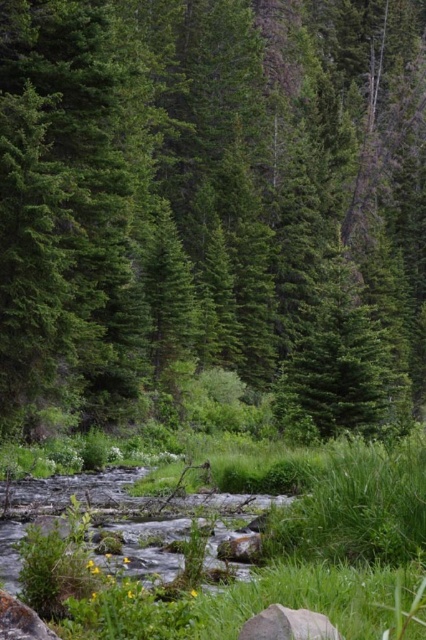
Based on the photo, can you confirm if green matte tree at center is positioned to the left of green grass at center?

Incorrect, green matte tree at center is not on the left side of green grass at center.

Which is behind, point (95, 97) or point (51, 550)?

Point (95, 97)

You are a GUI agent. You are given a task and a screenshot of the screen. Output one action in this format:
    pyautogui.click(x=<x>, y=<y>)
    Task: Click on the green matte tree at center
    The image size is (426, 640).
    Given the screenshot: What is the action you would take?
    click(196, 180)

The height and width of the screenshot is (640, 426). In order to click on green matte tree at center in this screenshot , I will do `click(196, 180)`.

What do you see at coordinates (196, 180) in the screenshot?
I see `green matte tree at center` at bounding box center [196, 180].

Identify the location of green matte tree at center. The height and width of the screenshot is (640, 426). (196, 180).

Does green grass at center lie in front of gray matte rock at lower center?

No.

Does green grass at center have a larger size compared to gray matte rock at lower center?

Correct, green grass at center is larger in size than gray matte rock at lower center.

Does point (273, 515) lie behind point (305, 612)?

Yes.

Where is `green grass at center`? The height and width of the screenshot is (640, 426). green grass at center is located at coordinates (302, 554).